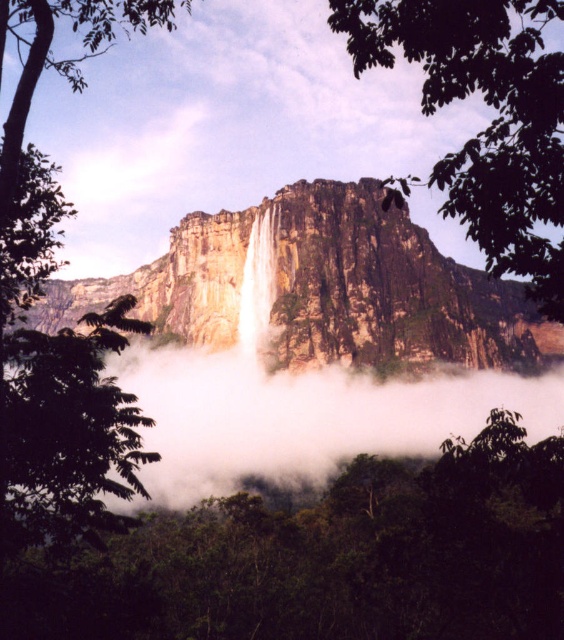
Question: Does rocky cliff at center have a lesser width compared to green leafy tree at center?

Choices:
 (A) yes
 (B) no

Answer: (B)

Question: Which of the following is the farthest from the observer?

Choices:
 (A) white smooth waterfall at center
 (B) green leafy tree at center

Answer: (A)

Question: Based on their relative distances, which object is farther from the green leafy tree at center?

Choices:
 (A) rocky cliff at center
 (B) white smooth waterfall at center

Answer: (B)

Question: Which point is closer to the camera?

Choices:
 (A) white smooth waterfall at center
 (B) green leafy tree at center

Answer: (B)

Question: Can you confirm if green leafy tree at center is bigger than white smooth waterfall at center?

Choices:
 (A) no
 (B) yes

Answer: (B)

Question: In this image, where is rocky cliff at center located relative to green leafy tree at center?

Choices:
 (A) above
 (B) below

Answer: (B)